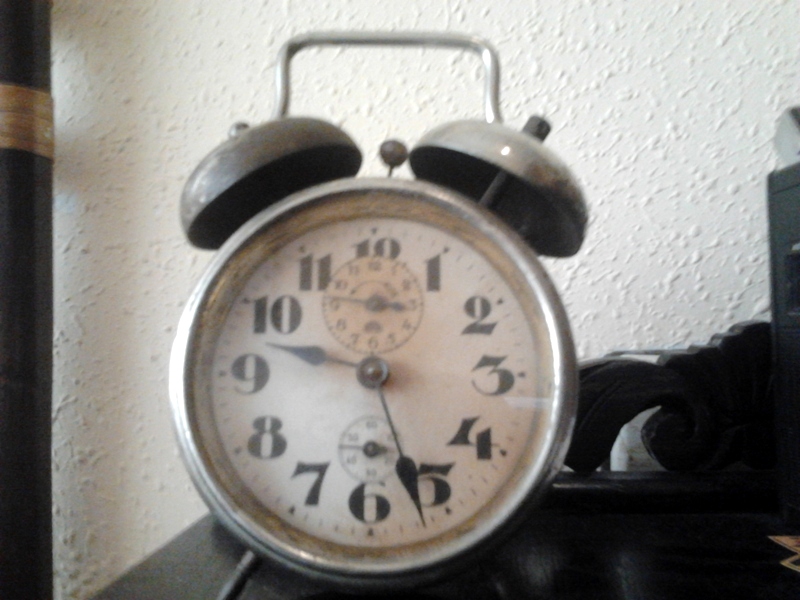
Locate an element on the screen. alarm clock leg/stand is located at coordinates (241, 574).